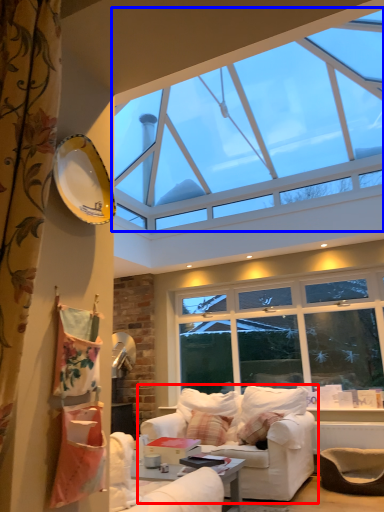
Question: Which of the following is the closest to the observer, studio couch (highlighted by a red box) or window (highlighted by a blue box)?

Choices:
 (A) studio couch
 (B) window

Answer: (B)